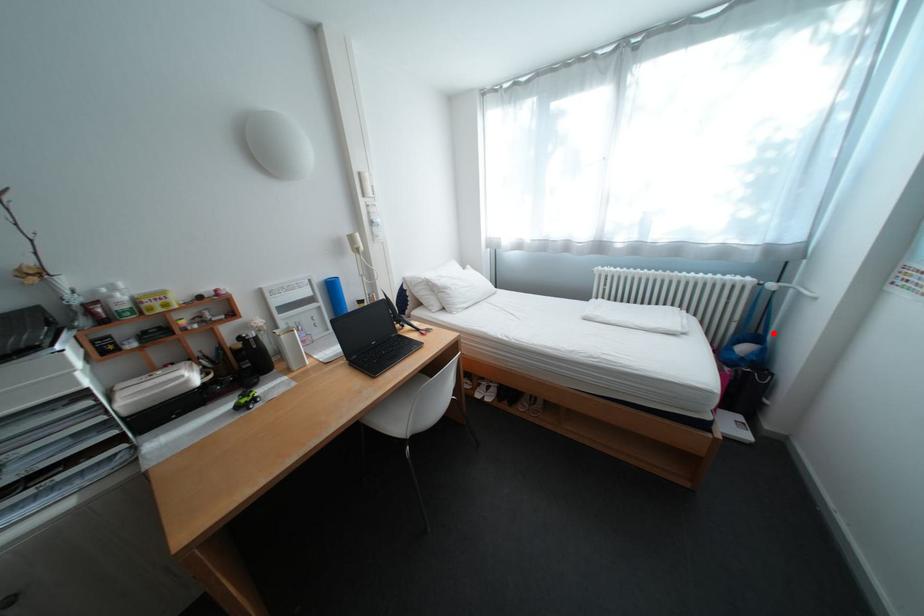
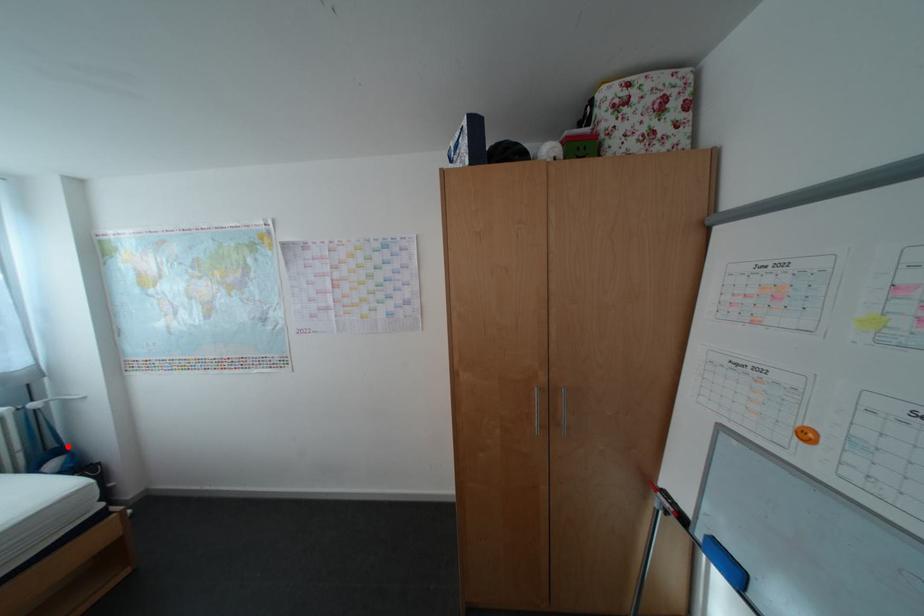
I am providing you with two images of the same scene from different viewpoints. A red point is marked on the first image and another point is marked on the second image. Are the points marked in image1 and image2 representing the same 3D position?

Yes